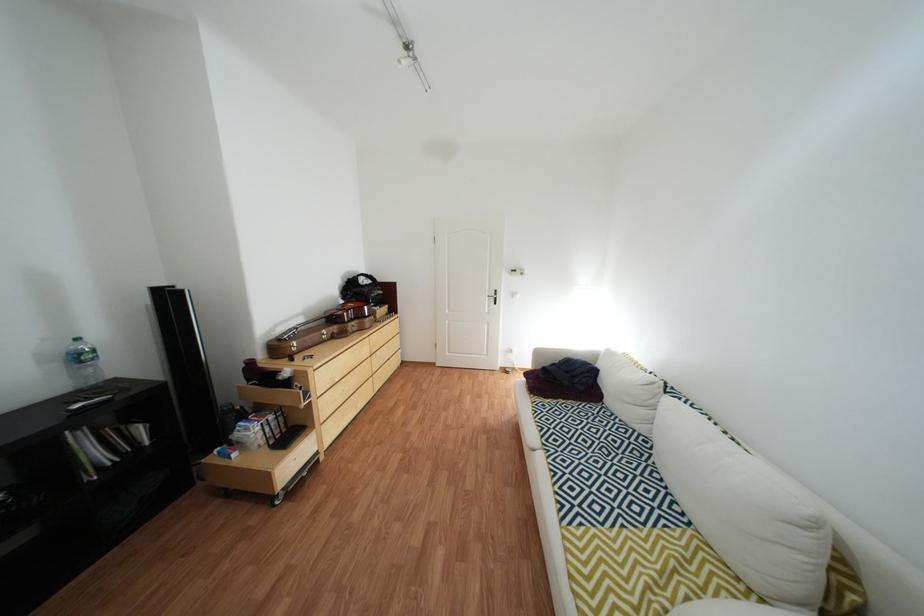
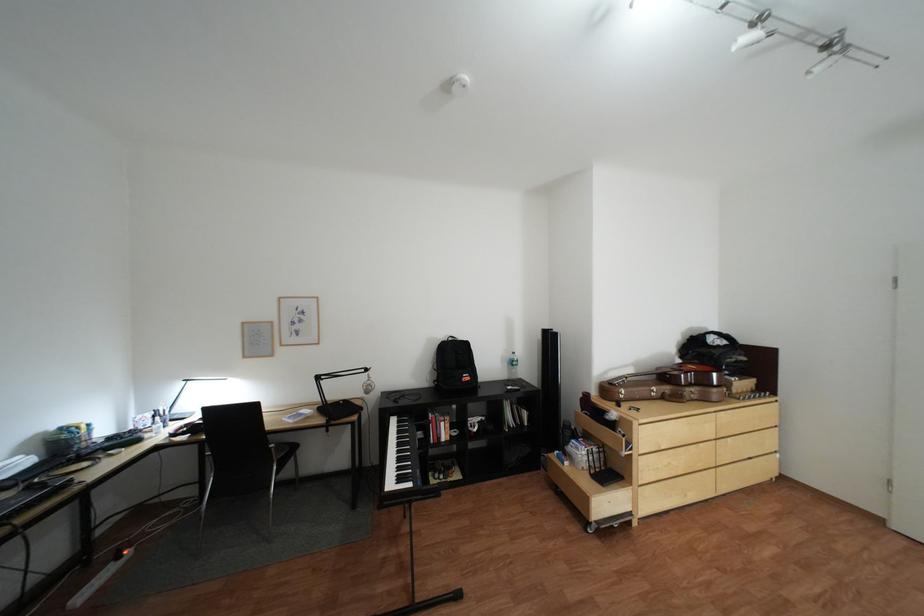
Locate, in the second image, the point that corresponds to point 283,477 in the first image.

(602, 500)